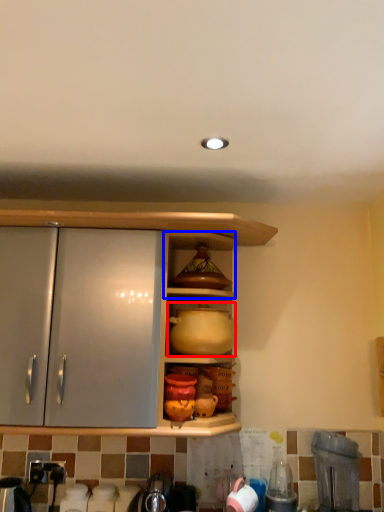
Question: Which of the following is the closest to the observer, pottery (highlighted by a red box) or shelf (highlighted by a blue box)?

Choices:
 (A) pottery
 (B) shelf

Answer: (A)